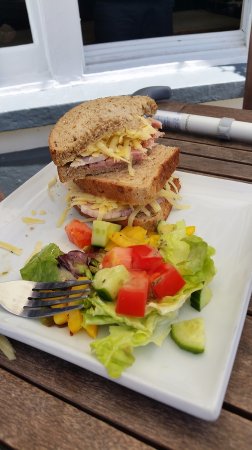
Where is `plate`? plate is located at coordinates (220, 233).